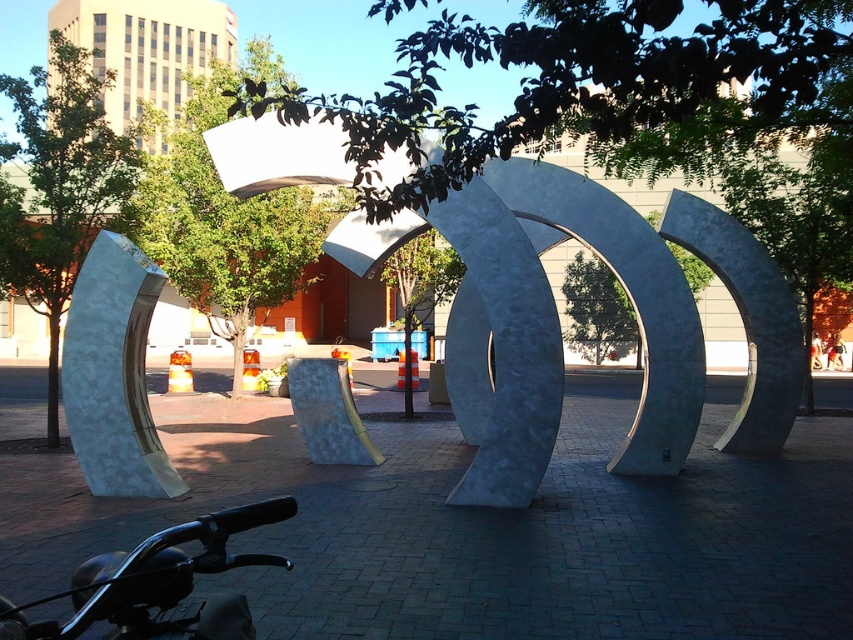
Between metallic silver sculpture at center and black matte motorcycle handlebars at lower left, which one is positioned lower?

black matte motorcycle handlebars at lower left is below.

Who is more forward, (689,212) or (221,554)?

Point (221,554) is more forward.

What are the coordinates of `metallic silver sculpture at center` in the screenshot? It's located at (630, 298).